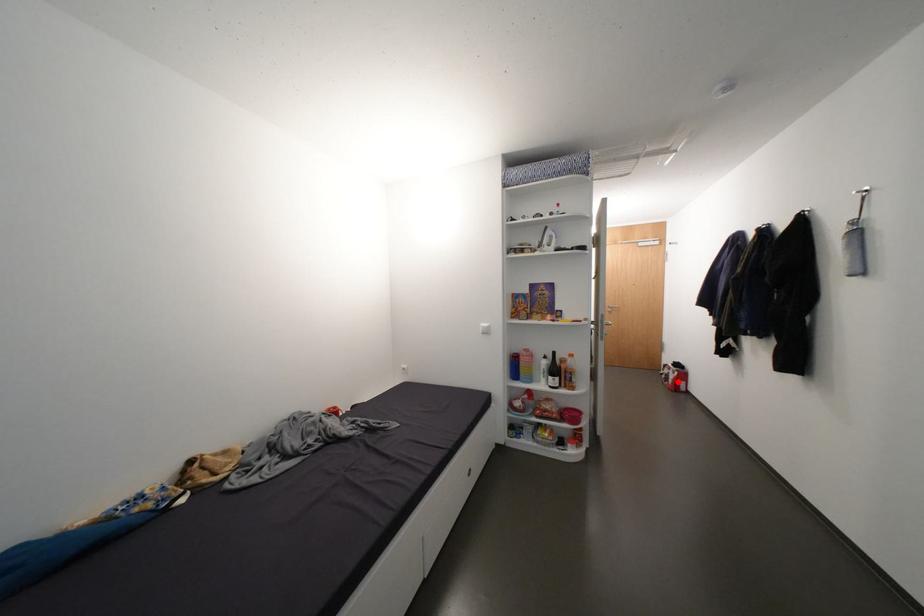
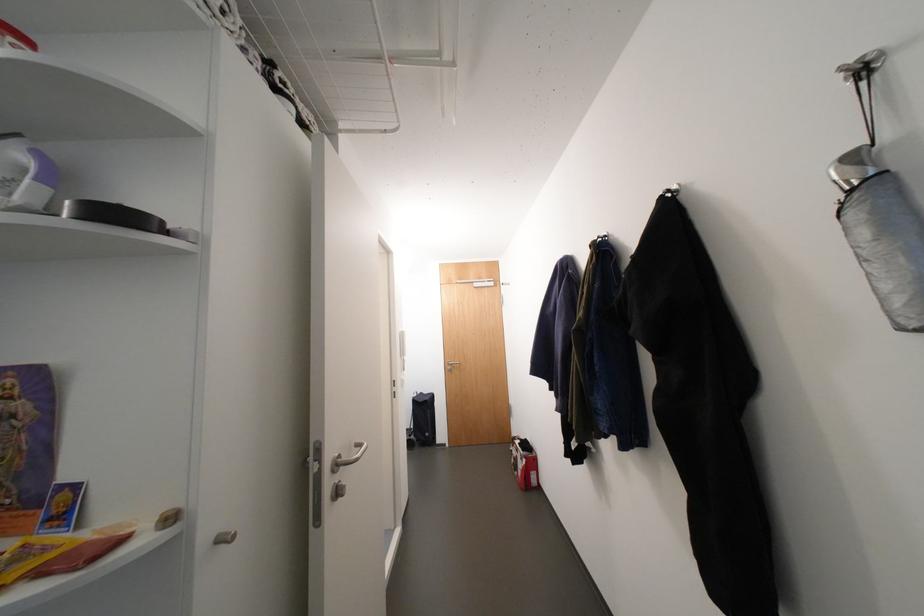
Question: I am providing you with two images of the same scene from different viewpoints. Given a red point in image1, look at the same physical point in image2. Is it:

Choices:
 (A) Closer to the viewpoint
 (B) Farther from the viewpoint

Answer: (B)